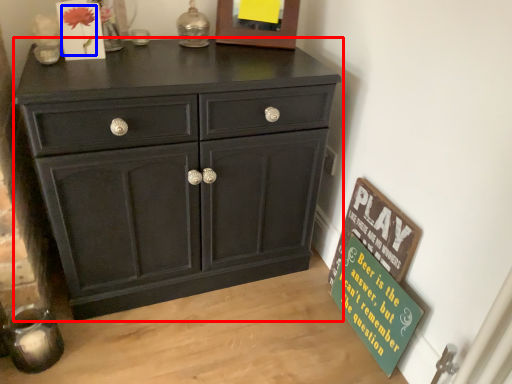
Question: Which point is further to the camera, chest of drawers (highlighted by a red box) or flower (highlighted by a blue box)?

Choices:
 (A) chest of drawers
 (B) flower

Answer: (B)